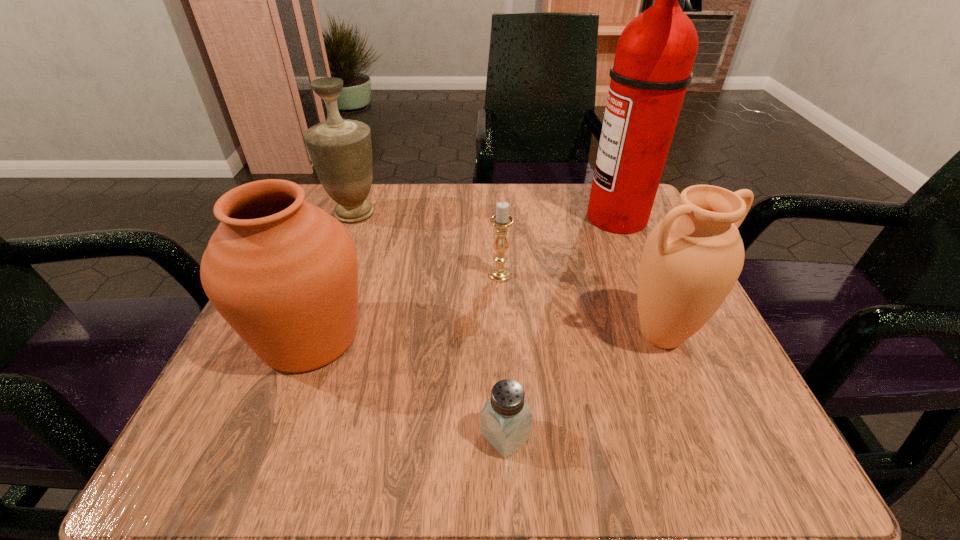
Locate an element on the screen. free space between the fire extinguisher and the fifth tallest object is located at coordinates (559, 246).

Find the location of a particular element. The image size is (960, 540). unoccupied position between the candle holder and the rightmost urn is located at coordinates (581, 305).

The width and height of the screenshot is (960, 540). In order to click on vacant space in between the rightmost urn and the candle holder in this screenshot , I will do pos(581,305).

The height and width of the screenshot is (540, 960). Find the location of `vacant region between the shortest object and the farthest urn`. vacant region between the shortest object and the farthest urn is located at coordinates (430, 325).

Identify which object is located as the nearest to the tallest object. Please provide its 2D coordinates. Your answer should be formatted as a tuple, i.e. [(x, y)], where the tuple contains the x and y coordinates of a point satisfying the conditions above.

[(691, 260)]

Identify which object is the fifth nearest to the farthest urn. Please provide its 2D coordinates. Your answer should be formatted as a tuple, i.e. [(x, y)], where the tuple contains the x and y coordinates of a point satisfying the conditions above.

[(691, 260)]

Where is `urn that is the closest to the fire extinguisher`? Image resolution: width=960 pixels, height=540 pixels. urn that is the closest to the fire extinguisher is located at coordinates (691, 260).

This screenshot has height=540, width=960. Identify the location of urn identified as the closest to the rightmost urn. point(283,273).

This screenshot has width=960, height=540. Identify the location of vacant space that satisfies the following two spatial constraints: 1. on the side of the fire extinguisher near the handle; 2. on the front side of the second shortest object. (641, 275).

Where is `vacant region that satisfies the following two spatial constraints: 1. on the side of the fire extinguisher near the handle; 2. on the front side of the rightmost urn`? vacant region that satisfies the following two spatial constraints: 1. on the side of the fire extinguisher near the handle; 2. on the front side of the rightmost urn is located at coordinates (666, 335).